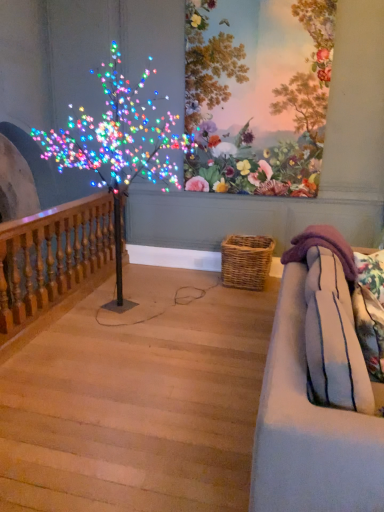
Question: Is light blue fabric couch at right outside wooden baluster at left?

Choices:
 (A) no
 (B) yes

Answer: (B)

Question: From a real-world perspective, is light blue fabric couch at right on wooden baluster at left?

Choices:
 (A) no
 (B) yes

Answer: (A)

Question: Considering the relative sizes of light blue fabric couch at right and wooden baluster at left in the image provided, is light blue fabric couch at right wider than wooden baluster at left?

Choices:
 (A) yes
 (B) no

Answer: (A)

Question: Is light blue fabric couch at right to the left of wooden baluster at left from the viewer's perspective?

Choices:
 (A) no
 (B) yes

Answer: (A)

Question: Is the position of light blue fabric couch at right less distant than that of wooden baluster at left?

Choices:
 (A) yes
 (B) no

Answer: (A)

Question: Can you confirm if light blue fabric couch at right is taller than wooden baluster at left?

Choices:
 (A) no
 (B) yes

Answer: (A)

Question: Are light wood stairwell at lower left and floral wallpaper at upper center beside each other?

Choices:
 (A) no
 (B) yes

Answer: (A)

Question: Is the depth of light wood stairwell at lower left greater than that of floral wallpaper at upper center?

Choices:
 (A) no
 (B) yes

Answer: (A)

Question: Is light wood stairwell at lower left outside of floral wallpaper at upper center?

Choices:
 (A) yes
 (B) no

Answer: (A)

Question: Is light wood stairwell at lower left closer to camera compared to floral wallpaper at upper center?

Choices:
 (A) yes
 (B) no

Answer: (A)

Question: Does light wood stairwell at lower left have a greater height compared to floral wallpaper at upper center?

Choices:
 (A) no
 (B) yes

Answer: (A)

Question: From a real-world perspective, is light wood stairwell at lower left under floral wallpaper at upper center?

Choices:
 (A) no
 (B) yes

Answer: (B)

Question: Is there a large distance between wooden baluster at left and woven brown basket at lower center?

Choices:
 (A) yes
 (B) no

Answer: (A)